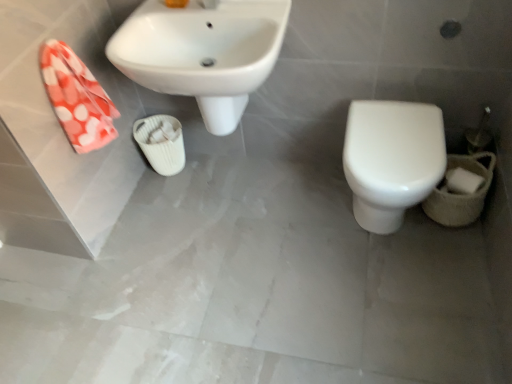
Question: Does white matte toilet paper at lower right have a lesser width compared to white glossy toilet at lower right?

Choices:
 (A) no
 (B) yes

Answer: (B)

Question: Is white matte toilet paper at lower right outside of white glossy toilet at lower right?

Choices:
 (A) no
 (B) yes

Answer: (B)

Question: Can you confirm if white matte toilet paper at lower right is shorter than white glossy toilet at lower right?

Choices:
 (A) yes
 (B) no

Answer: (A)

Question: Does white matte toilet paper at lower right appear on the right side of white glossy toilet at lower right?

Choices:
 (A) yes
 (B) no

Answer: (A)

Question: From the image's perspective, is white matte toilet paper at lower right located beneath white glossy toilet at lower right?

Choices:
 (A) yes
 (B) no

Answer: (A)

Question: Would you say white ribbed cup at center is inside or outside white glossy sink at upper left?

Choices:
 (A) inside
 (B) outside

Answer: (B)

Question: Is point (169, 155) positioned closer to the camera than point (109, 59)?

Choices:
 (A) farther
 (B) closer

Answer: (A)

Question: From their relative heights in the image, would you say white ribbed cup at center is taller or shorter than white glossy sink at upper left?

Choices:
 (A) short
 (B) tall

Answer: (A)

Question: In terms of size, does white ribbed cup at center appear bigger or smaller than white glossy sink at upper left?

Choices:
 (A) big
 (B) small

Answer: (B)

Question: Does point (134, 49) appear closer or farther from the camera than point (454, 188)?

Choices:
 (A) closer
 (B) farther

Answer: (A)

Question: In the image, is white glossy sink at upper left positioned in front of or behind white matte toilet paper at lower right?

Choices:
 (A) behind
 (B) front

Answer: (B)

Question: Looking at their shapes, would you say white glossy sink at upper left is wider or thinner than white matte toilet paper at lower right?

Choices:
 (A) thin
 (B) wide

Answer: (B)

Question: Visually, is white glossy sink at upper left positioned to the left or to the right of white matte toilet paper at lower right?

Choices:
 (A) right
 (B) left

Answer: (B)

Question: Visually, is white ribbed cup at center positioned to the left or to the right of white glossy toilet at lower right?

Choices:
 (A) left
 (B) right

Answer: (A)

Question: Is white ribbed cup at center situated inside white glossy toilet at lower right or outside?

Choices:
 (A) outside
 (B) inside

Answer: (A)